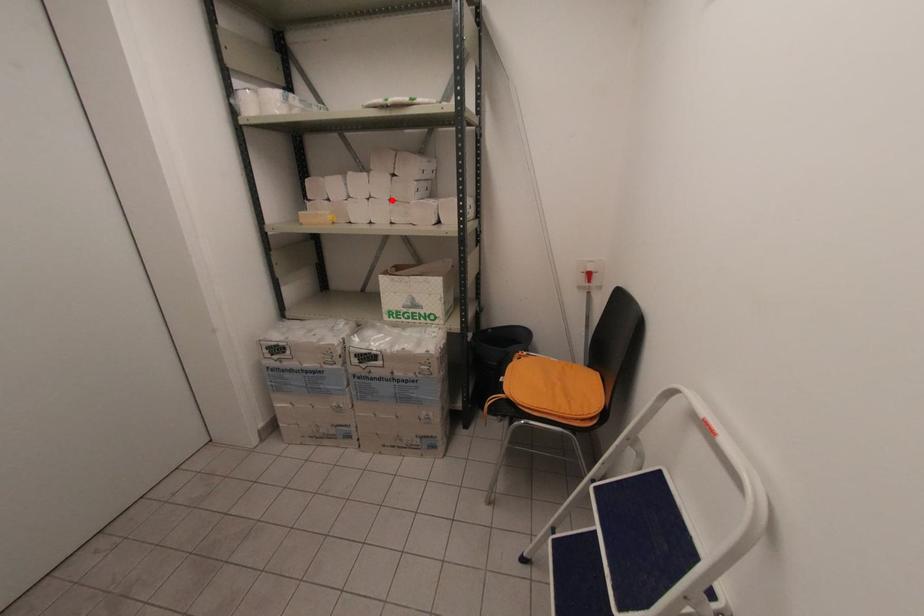
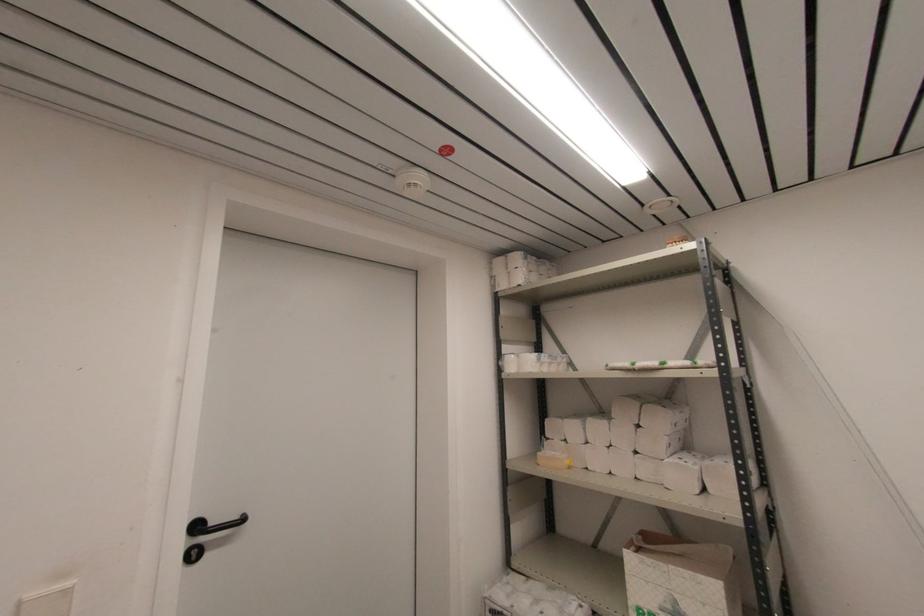
Question: A red point is marked in image1. In image2, is the corresponding 3D point closer to the camera or farther? Reply with the corresponding letter.

Choices:
 (A) The corresponding 3D point is closer.
 (B) The corresponding 3D point is farther.

Answer: (B)